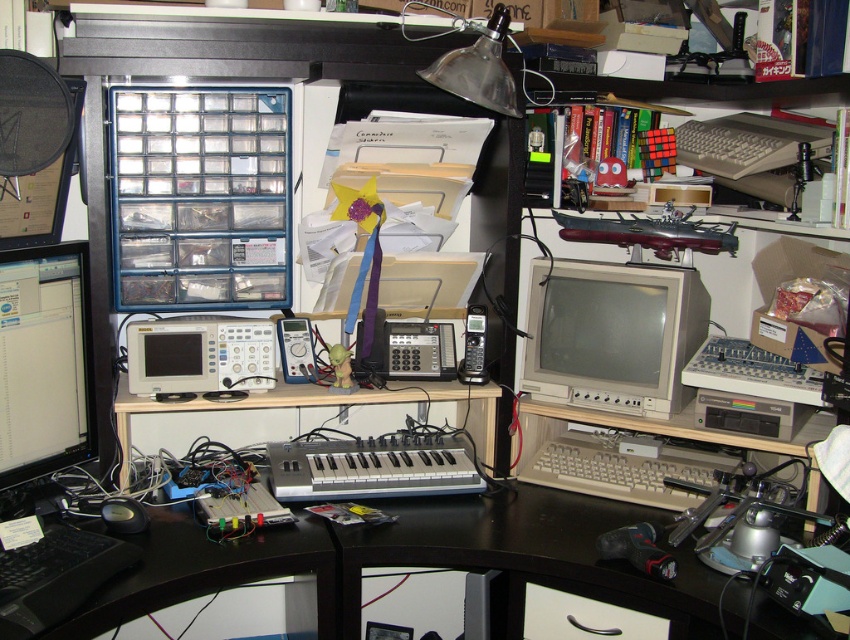
Question: Which of these objects is positioned farthest from the beige plastic monitor at center?

Choices:
 (A) beige plastic keyboard at lower center
 (B) matte black monitor at left

Answer: (B)

Question: Can you confirm if matte black monitor at left is thinner than beige plastic keyboard at lower center?

Choices:
 (A) no
 (B) yes

Answer: (B)

Question: Is beige plastic monitor at center to the left of matte black monitor at left from the viewer's perspective?

Choices:
 (A) yes
 (B) no

Answer: (B)

Question: Can you confirm if beige plastic monitor at center is smaller than beige plastic keyboard at lower center?

Choices:
 (A) yes
 (B) no

Answer: (B)

Question: Which object appears closest to the camera in this image?

Choices:
 (A) beige plastic monitor at center
 (B) beige plastic keyboard at lower center

Answer: (B)

Question: Which of the following is the closest to the observer?

Choices:
 (A) (88, 291)
 (B) (678, 474)

Answer: (A)